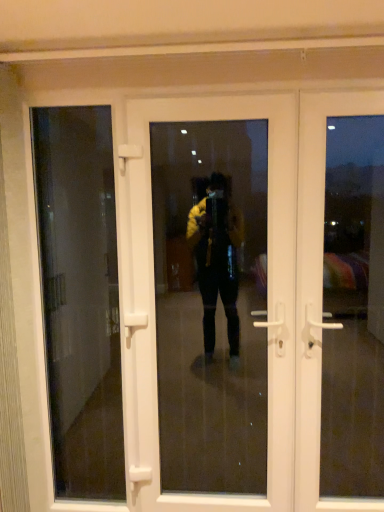
Locate an element on the screen. The image size is (384, 512). free spot above white plastic door at right, the first door when ordered from right to left (from a real-world perspective) is located at coordinates (349, 85).